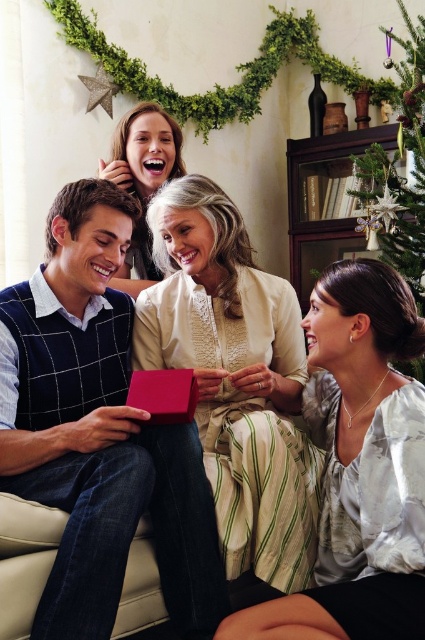
Does point (217, 256) come farther from viewer compared to point (367, 476)?

Yes, it is behind point (367, 476).

Who is shorter, matte cream blouse at center or silky white blouse at lower right?

With less height is silky white blouse at lower right.

This screenshot has width=425, height=640. I want to click on matte cream blouse at center, so click(x=235, y=378).

This screenshot has width=425, height=640. What are the coordinates of `matte cream blouse at center` in the screenshot? It's located at point(235,378).

Does silky white blouse at lower right appear on the left side of shiny red box at center?

No, silky white blouse at lower right is not to the left of shiny red box at center.

Can you confirm if silky white blouse at lower right is positioned to the right of shiny red box at center?

Correct, you'll find silky white blouse at lower right to the right of shiny red box at center.

At what (x,y) coordinates should I click in order to perform the action: click on silky white blouse at lower right. Please return your answer as a coordinate pair (x, y). Looking at the image, I should click on (359, 465).

Which is behind, point (218, 195) or point (416, 58)?

Positioned behind is point (416, 58).

Can you confirm if matte cream blouse at center is positioned below green textured christmas tree at upper right?

Correct, matte cream blouse at center is located below green textured christmas tree at upper right.

The width and height of the screenshot is (425, 640). I want to click on matte cream blouse at center, so click(235, 378).